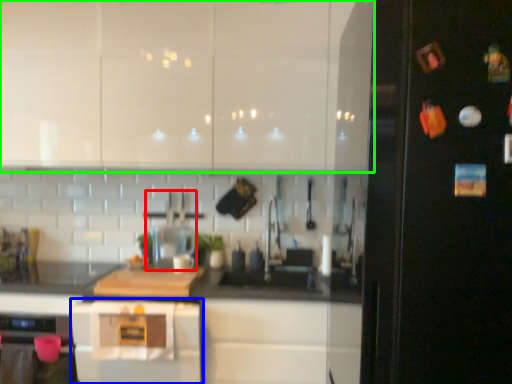
Question: Which object is the closest to the appliance (highlighted by a red box)? Choose among these: home appliance (highlighted by a blue box) or cabinetry (highlighted by a green box).

Choices:
 (A) home appliance
 (B) cabinetry

Answer: (A)